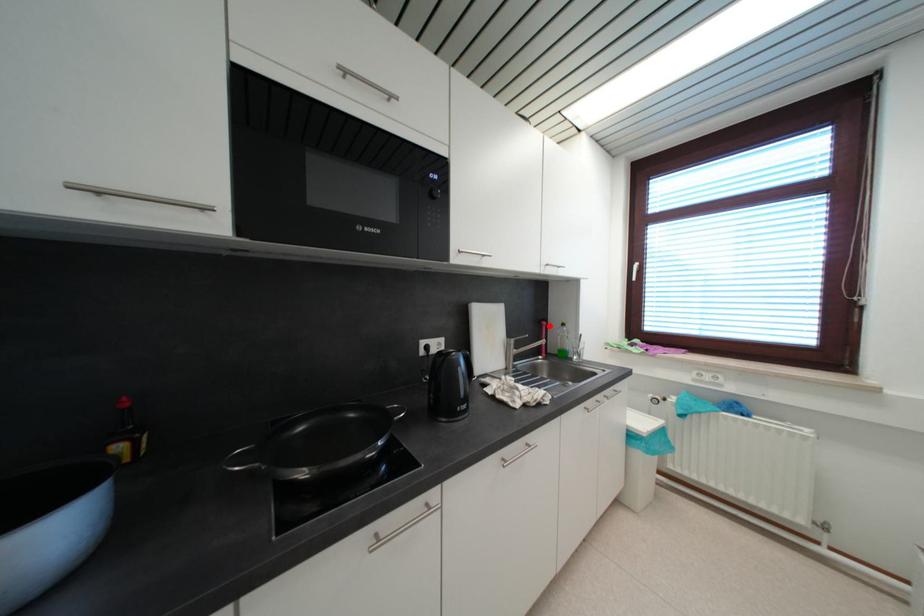
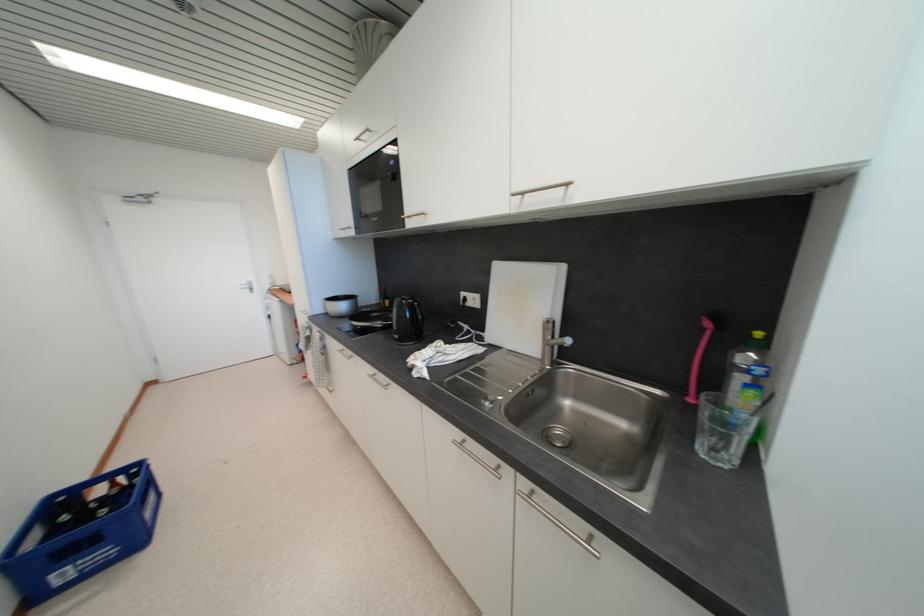
The point at the highlighted location is marked in the first image. Where is the corresponding point in the second image?

(713, 326)